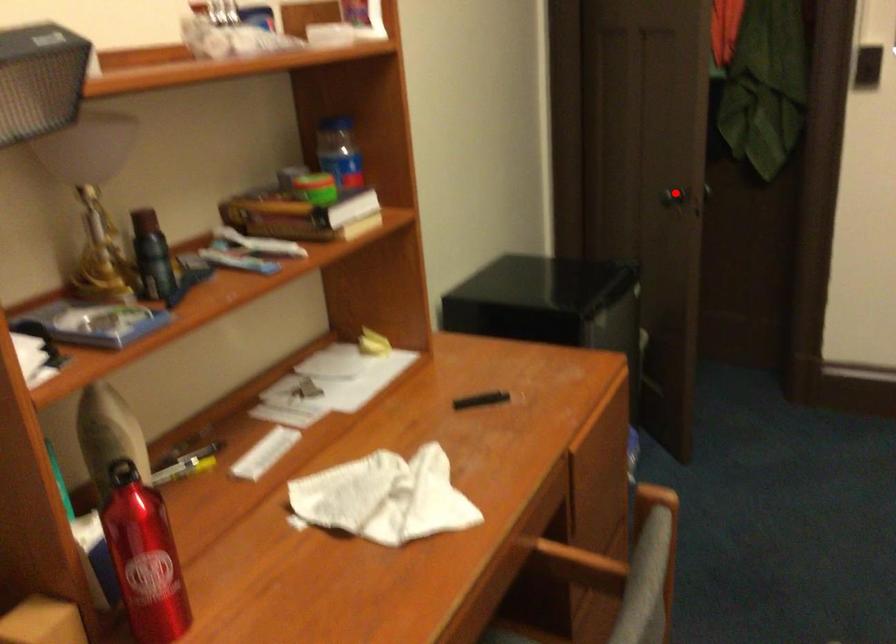
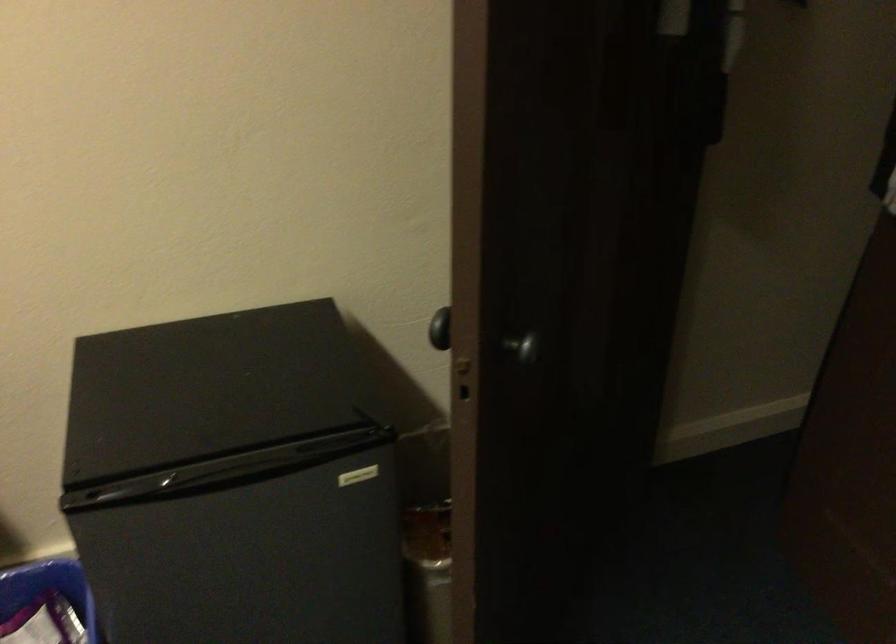
Question: I am providing you with two images of the same scene from different viewpoints. In image1, a red point is highlighted. Considering the same 3D point in image2, which of the following is correct?

Choices:
 (A) It is closer
 (B) It is farther

Answer: (A)